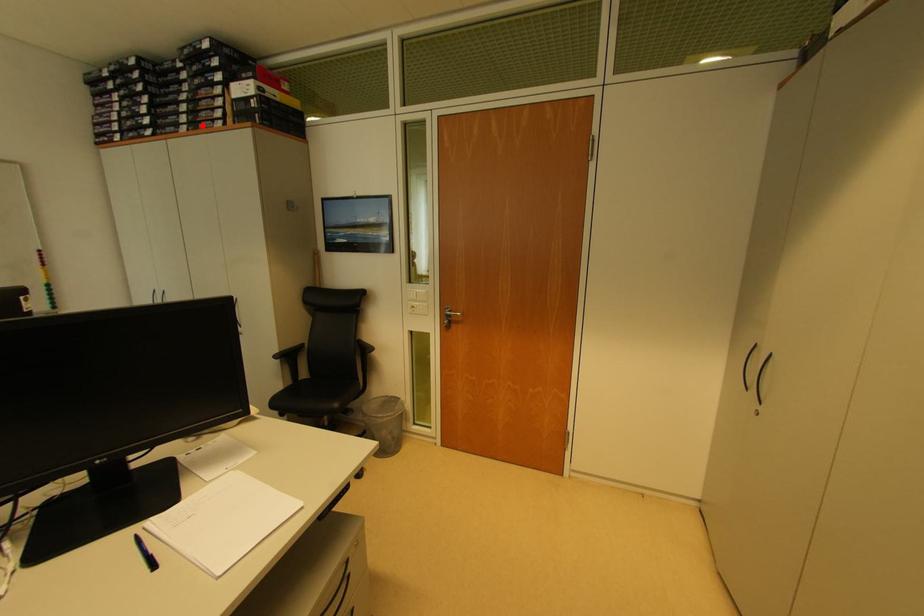
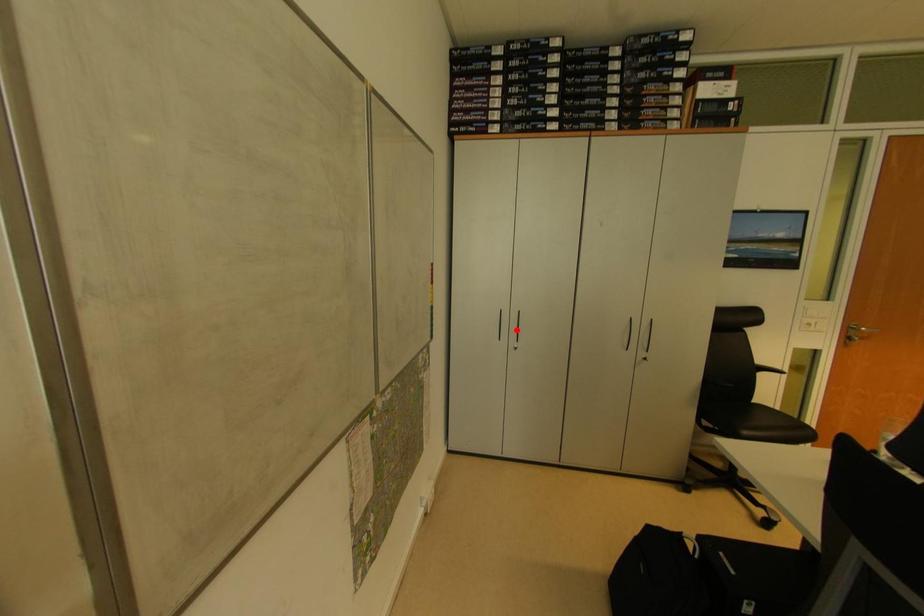
I am providing you with two images of the same scene from different viewpoints. A red point is marked on the first image and another point is marked on the second image. Does the point marked in image1 correspond to the same location as the one in image2?

No